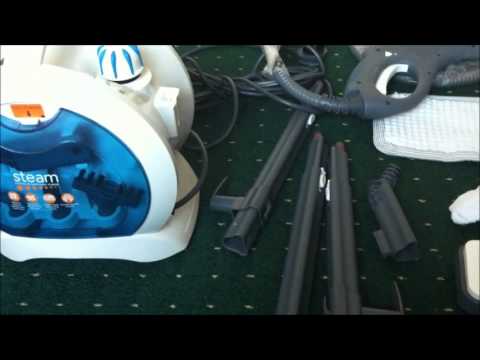
This screenshot has width=480, height=360. I want to click on steam cleaner cord, so click(226, 88).